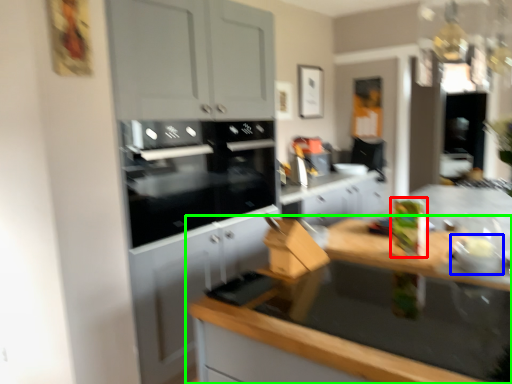
Question: Based on their relative distances, which object is farther from appliance (highlighted by a red box)? Choose from appliance (highlighted by a blue box) and countertop (highlighted by a green box).

Choices:
 (A) appliance
 (B) countertop

Answer: (B)